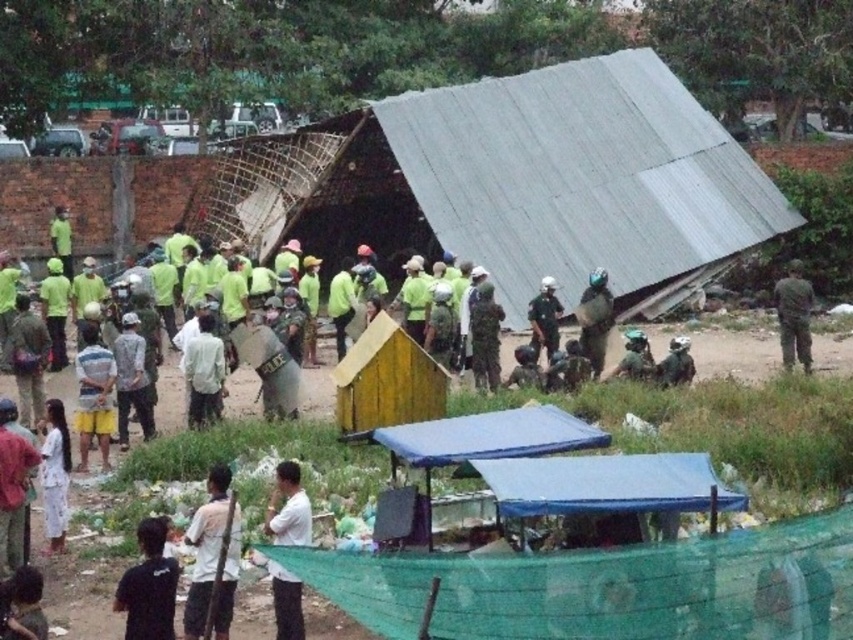
Question: Is white matte shirt at lower center above white matte shirt at center?

Choices:
 (A) yes
 (B) no

Answer: (B)

Question: Does black matte shirt at lower left have a smaller size compared to green camouflage uniform at right?

Choices:
 (A) no
 (B) yes

Answer: (A)

Question: Which of the following is the farthest from the observer?

Choices:
 (A) (222, 636)
 (B) (137, 632)

Answer: (A)

Question: Estimate the real-world distances between objects in this image. Which object is closer to the white cotton dress at lower left?

Choices:
 (A) green camouflage uniform at right
 (B) white matte shirt at center

Answer: (B)

Question: Is the position of white cotton dress at lower left less distant than that of green camouflage uniform at right?

Choices:
 (A) no
 (B) yes

Answer: (B)

Question: Which object is the farthest from the white matte shirt at lower center?

Choices:
 (A) green camouflage uniform at right
 (B) white cotton dress at lower left
 (C) black matte shirt at lower left

Answer: (A)